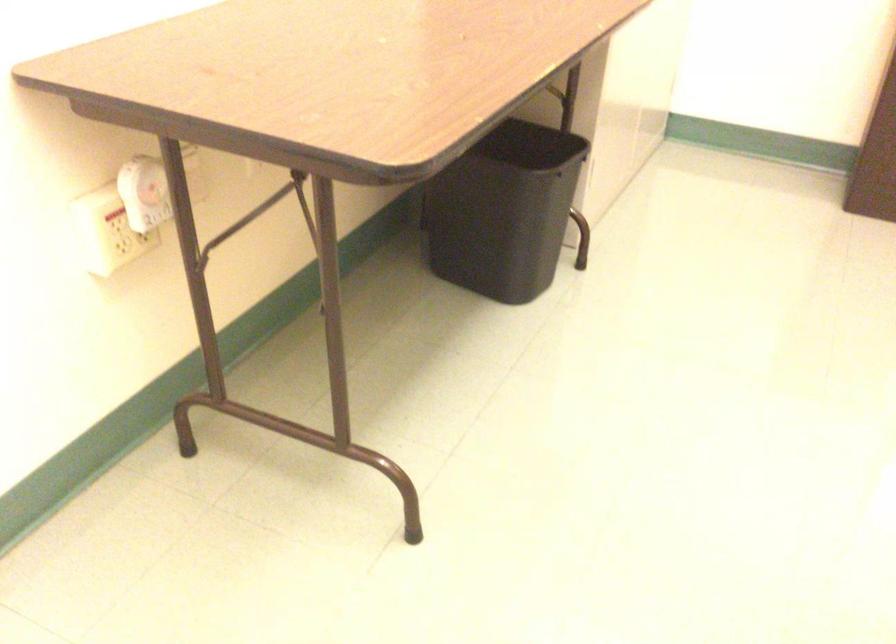
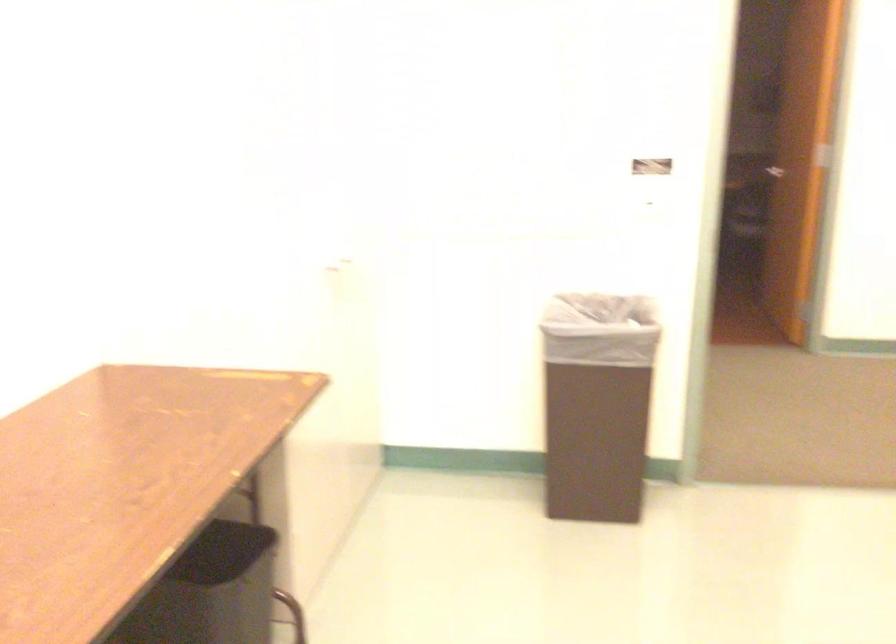
What movement of the cameraman would produce the second image?

The cameraman walked toward right, backward.